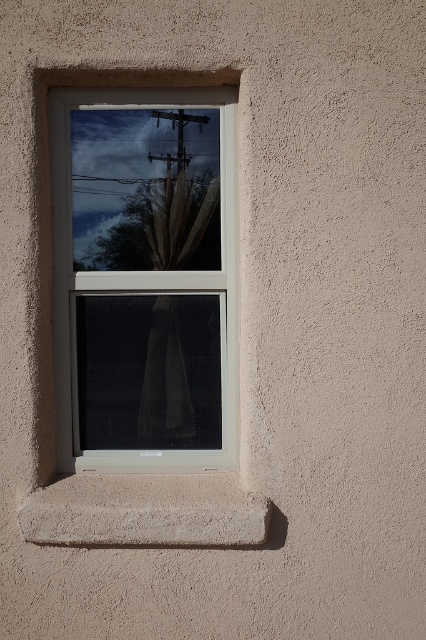
From the picture: A small toy car is placed on the smooth concrete window sill at lower center. If the toy car is 2 feet long, can it fit entirely on the window sill without hanging over the edge?

The smooth concrete window sill at lower center is 8.10 feet in length. Since the toy car is only 2 feet long, it can fit entirely on the window sill without hanging over the edge.

You are standing in a room and want to place a small potted plant on the window sill. Based on the scene, which object should you place it on, the white plastic window frame at center or the smooth concrete window sill at lower center?

You should place the small potted plant on the smooth concrete window sill at lower center because the white plastic window frame at center is to the left of it, and window sills are typically the horizontal surface where plants are placed.